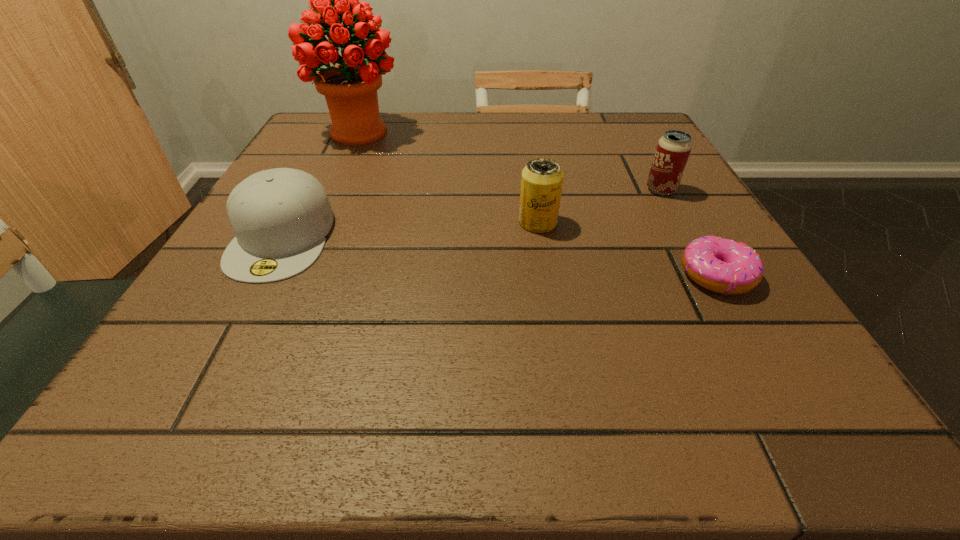
The height and width of the screenshot is (540, 960). What are the coordinates of `free space between the cap and the shortest object` in the screenshot? It's located at (499, 256).

Locate an element on the screen. The height and width of the screenshot is (540, 960). vacant space that's between the nearer beer can and the shortest object is located at coordinates (627, 249).

Where is `vacant point located between the left beer can and the tallest object`? Image resolution: width=960 pixels, height=540 pixels. vacant point located between the left beer can and the tallest object is located at coordinates (448, 177).

I want to click on object that is the third closest to the doughnut, so click(x=280, y=217).

Locate an element on the screen. Image resolution: width=960 pixels, height=540 pixels. the closest object to the right beer can is located at coordinates (723, 266).

Where is `vacant point that satisfies the following two spatial constraints: 1. on the front side of the farthest object; 2. on the right side of the right beer can`? vacant point that satisfies the following two spatial constraints: 1. on the front side of the farthest object; 2. on the right side of the right beer can is located at coordinates (333, 190).

This screenshot has width=960, height=540. Find the location of `vacant space that satisfies the following two spatial constraints: 1. on the front-facing side of the cap; 2. on the right side of the doughnut`. vacant space that satisfies the following two spatial constraints: 1. on the front-facing side of the cap; 2. on the right side of the doughnut is located at coordinates click(x=261, y=275).

This screenshot has width=960, height=540. What are the coordinates of `free spot that satisfies the following two spatial constraints: 1. on the front side of the shortest object; 2. on the left side of the bouquet` in the screenshot? It's located at (294, 275).